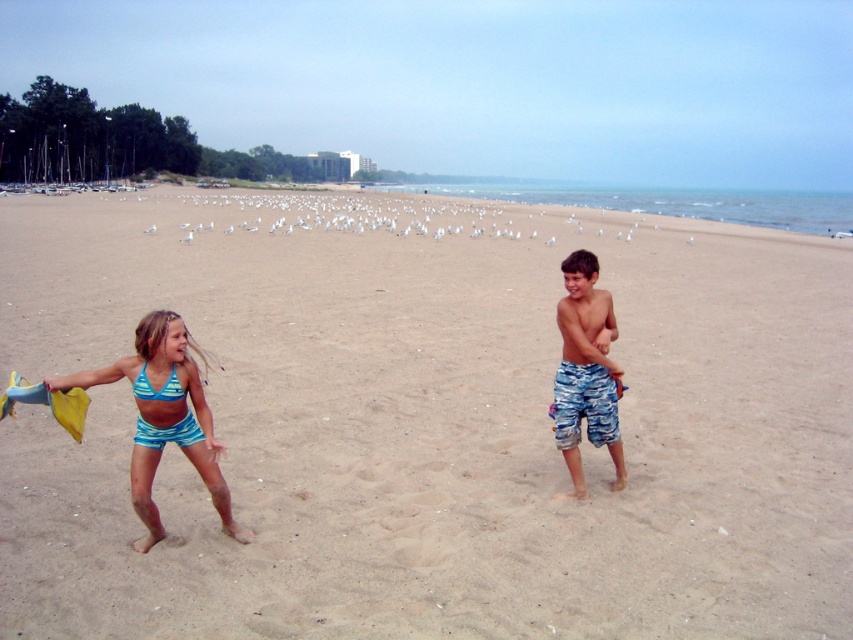
Question: Does beige sandy beach at center have a lesser width compared to camouflage shorts at right?

Choices:
 (A) yes
 (B) no

Answer: (B)

Question: Is beige sandy beach at center smaller than blue striped swimsuit at lower left?

Choices:
 (A) no
 (B) yes

Answer: (A)

Question: Which point is farther to the camera?

Choices:
 (A) camouflage shorts at right
 (B) blue striped swimsuit at lower left
 (C) blue fabric bikini top at center-left
 (D) beige sandy beach at center

Answer: (A)

Question: Among these points, which one is farthest from the camera?

Choices:
 (A) (154, 508)
 (B) (141, 394)
 (C) (572, 323)
 (D) (845, 241)

Answer: (D)

Question: Which of these objects is positioned closest to the blue fabric bikini top at center-left?

Choices:
 (A) camouflage shorts at right
 (B) beige sandy beach at center

Answer: (A)

Question: Is the position of beige sandy beach at center more distant than that of blue fabric bikini top at center-left?

Choices:
 (A) yes
 (B) no

Answer: (B)